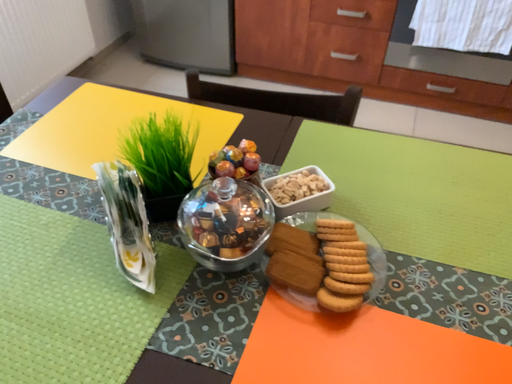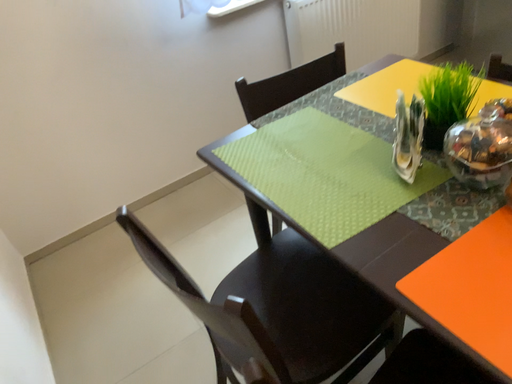
Question: Which way did the camera rotate in the video?

Choices:
 (A) rotated upward
 (B) rotated downward

Answer: (A)